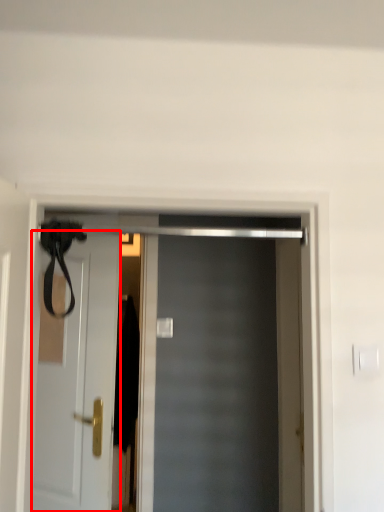
Question: From the image's perspective, considering the relative positions of door (annotated by the red box) and door in the image provided, where is door (annotated by the red box) located with respect to the staircase?

Choices:
 (A) above
 (B) below

Answer: (B)